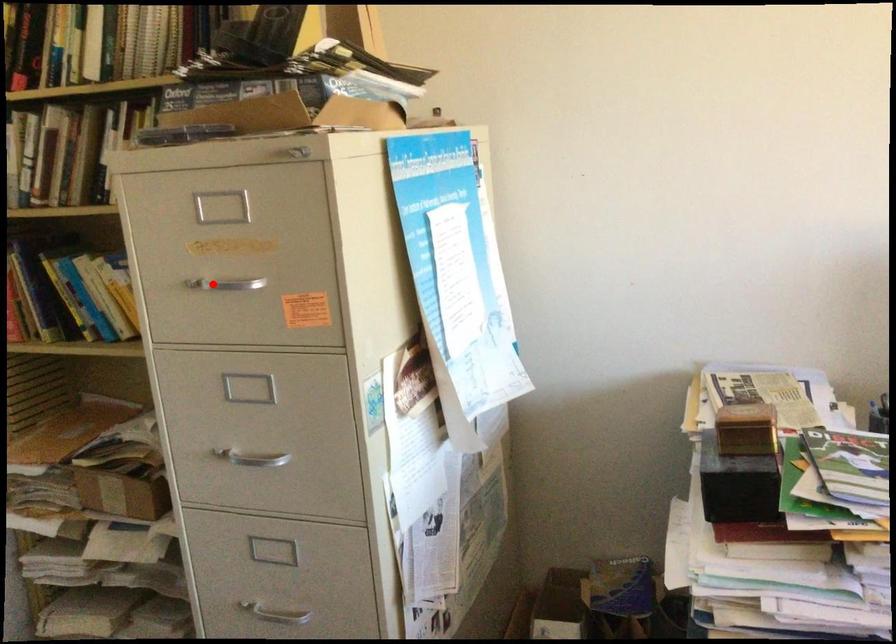
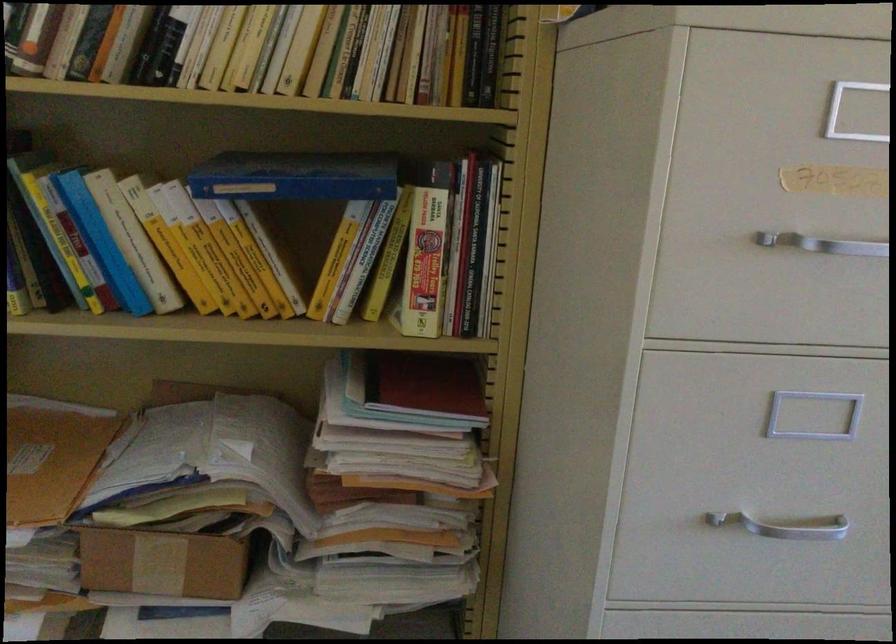
The point at the highlighted location is marked in the first image. Where is the corresponding point in the second image?

(823, 243)